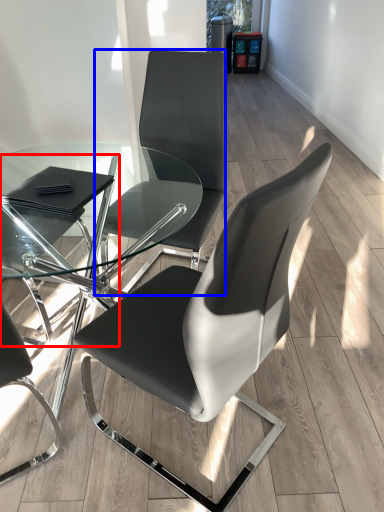
Question: Which object is closer to the camera taking this photo, chair (highlighted by a red box) or chair (highlighted by a blue box)?

Choices:
 (A) chair
 (B) chair

Answer: (A)